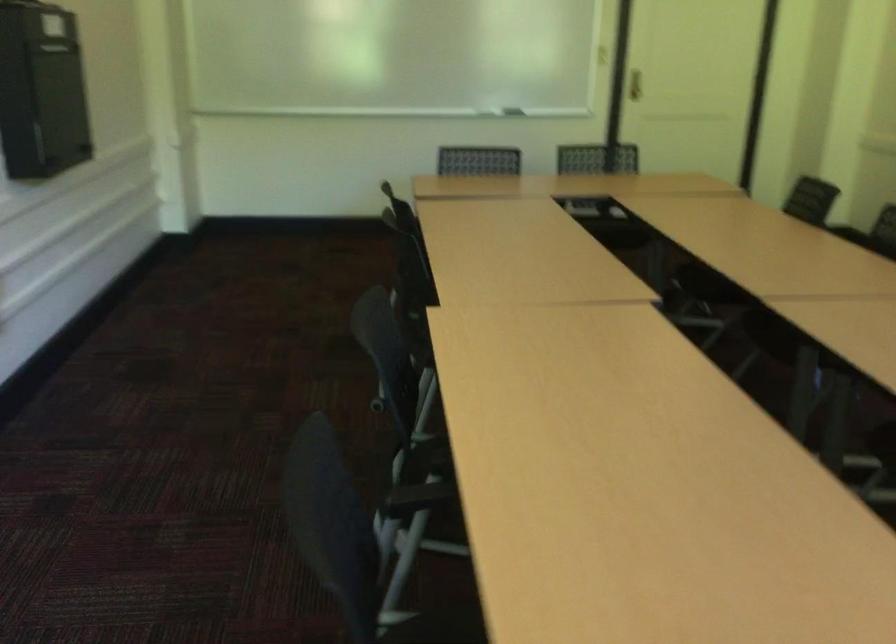
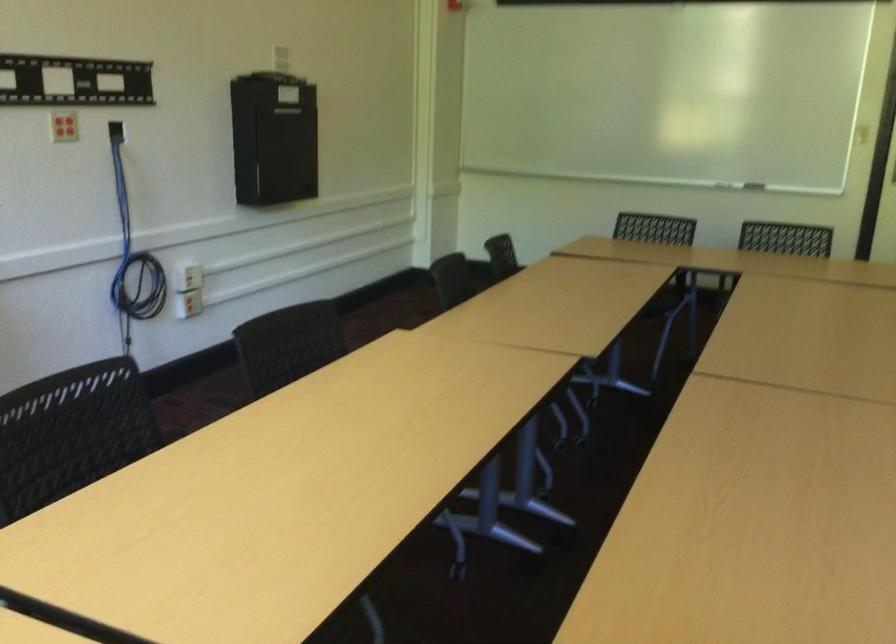
Locate, in the second image, the point that corresponds to point (312, 538) in the first image.

(71, 433)